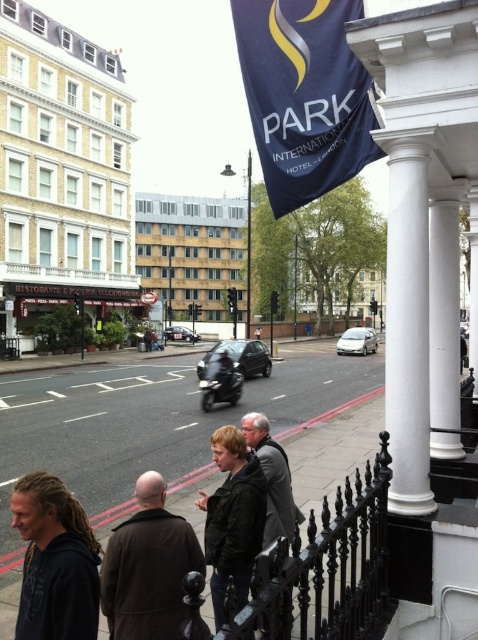
Question: Which object appears farthest from the camera in this image?

Choices:
 (A) black leather jacket at center
 (B) dark brown hair at lower left

Answer: (A)

Question: Is dark blue fabric flag at upper center below brown leather coat at lower left?

Choices:
 (A) yes
 (B) no

Answer: (B)

Question: Which of the following is the farthest from the observer?

Choices:
 (A) concrete sidewalk at lower center
 (B) dark brown hair at lower left

Answer: (A)

Question: Can you confirm if dark blue fabric flag at upper center is smaller than black leather jacket at center?

Choices:
 (A) yes
 (B) no

Answer: (B)

Question: Which point appears closest to the camera in this image?

Choices:
 (A) (107, 552)
 (B) (312, 4)
 (C) (235, 403)
 (D) (49, 545)

Answer: (D)

Question: In this image, where is brown leather coat at lower left located relative to dark gray jacket at center?

Choices:
 (A) left
 (B) right

Answer: (A)